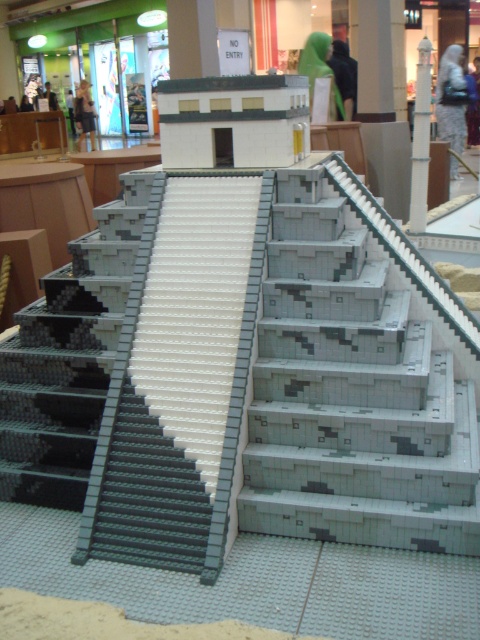
You are a GUI agent. You are given a task and a screenshot of the screen. Output one action in this format:
    pyautogui.click(x=<x>, y=<y>)
    Task: Click on the gray lego stairs at center
    The height and width of the screenshot is (640, 480).
    Given the screenshot: What is the action you would take?
    pyautogui.click(x=351, y=394)

Between gray lego stairs at center and gray matte stairs at left, which one appears on the right side from the viewer's perspective?

gray lego stairs at center is more to the right.

Does point (392, 362) lie in front of point (1, 417)?

That is True.

Locate an element on the screen. The height and width of the screenshot is (640, 480). gray lego stairs at center is located at coordinates (351, 394).

Can you confirm if gray plastic stairs at center is positioned below gray matte stairs at left?

Indeed, gray plastic stairs at center is positioned under gray matte stairs at left.

I want to click on gray plastic stairs at center, so click(x=173, y=400).

Between gray lego stairs at center and gray plastic stairs at center, which one has less height?

With less height is gray lego stairs at center.

Is gray lego stairs at center to the right of gray plastic stairs at center from the viewer's perspective?

Yes, gray lego stairs at center is to the right of gray plastic stairs at center.

Which is in front, point (442, 531) or point (222, 476)?

Point (442, 531) is in front.

At what (x,y) coordinates should I click in order to perform the action: click on gray lego stairs at center. Please return your answer as a coordinate pair (x, y). Looking at the image, I should click on (351, 394).